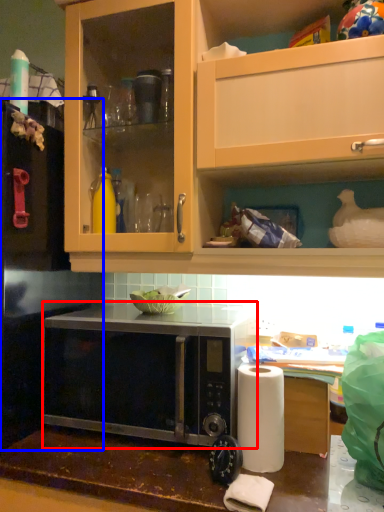
Question: Which object is closer to the camera taking this photo, microwave oven (highlighted by a red box) or appliance (highlighted by a blue box)?

Choices:
 (A) microwave oven
 (B) appliance

Answer: (A)